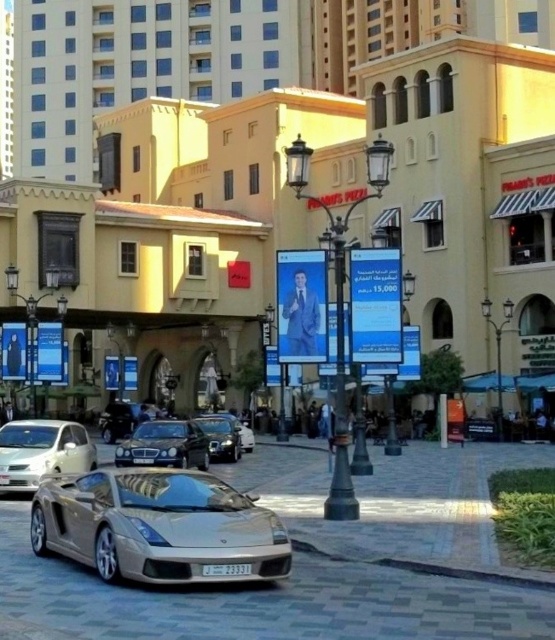
You are a photographer standing on the sidewalk and want to take a picture of the gold metallic sports car at center without including the matte yellow building at center in the frame. Is this possible given their positions?

The matte yellow building at center is positioned over the gold metallic sports car at center, so it would block the view of the car. Therefore, it is not possible to take a picture of the gold metallic sports car at center without including the matte yellow building at center in the frame.

You are a delivery driver who needs to park your vehicle between the matte yellow building at center and the gold metallic sports car at center. Can you fit your truck, which is 2.5 meters wide, in the space between them?

The matte yellow building at center might be wider than the gold metallic sports car at center, but without exact measurements, it is uncertain if the 2.5 meter wide truck can fit between them. Check the actual space before deciding.

You are a delivery driver who needs to park your delivery van, which is 1.8 meters tall, in a parking spot near the white glossy sedan at lower left and the shiny silver car at center. Based on the scene, can your van fit between these two vehicles without hitting the roof?

The white glossy sedan at lower left is much taller than the shiny silver car at center. Since the van is 1.8 meters tall, it can fit between them as long as there is enough vertical space between the two cars. However, since the white glossy sedan is taller, the available height might be limited. Without exact measurements, it is uncertain if the van will fit. Please check the actual space before proceeding.